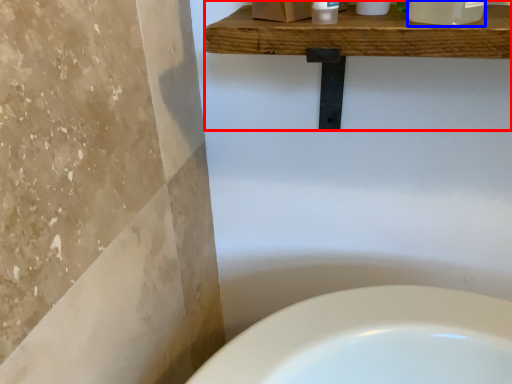
Question: Which of the following is the closest to the observer, balustrade (highlighted by a red box) or cleaning product (highlighted by a blue box)?

Choices:
 (A) balustrade
 (B) cleaning product

Answer: (B)